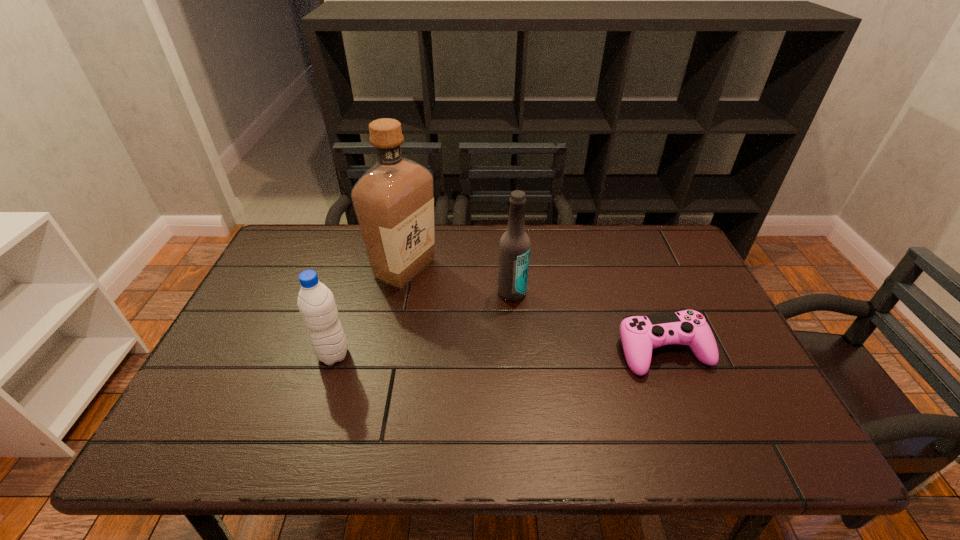
Find the location of a particular element. blank area located on the front-facing side of the liquor is located at coordinates (445, 343).

The height and width of the screenshot is (540, 960). What are the coordinates of `vacant space located on the label of the second tallest object` in the screenshot? It's located at (540, 386).

Where is `vacant space located on the label of the second tallest object`? vacant space located on the label of the second tallest object is located at coordinates (519, 316).

Locate an element on the screen. The height and width of the screenshot is (540, 960). free spot located on the label of the second tallest object is located at coordinates pyautogui.click(x=534, y=362).

Image resolution: width=960 pixels, height=540 pixels. What are the coordinates of `object at the far edge` in the screenshot? It's located at (393, 201).

At what (x,y) coordinates should I click in order to perform the action: click on object that is at the right edge. Please return your answer as a coordinate pair (x, y). Looking at the image, I should click on (640, 334).

Image resolution: width=960 pixels, height=540 pixels. I want to click on vacant space at the far edge of the desktop, so [614, 260].

Locate an element on the screen. The image size is (960, 540). vacant space at the near edge of the desktop is located at coordinates click(x=365, y=386).

The image size is (960, 540). In the image, there is a desktop. Find the location of `free region at the left edge`. free region at the left edge is located at coordinates (274, 339).

In the image, there is a desktop. Where is `vacant space at the right edge`? The width and height of the screenshot is (960, 540). vacant space at the right edge is located at coordinates (732, 345).